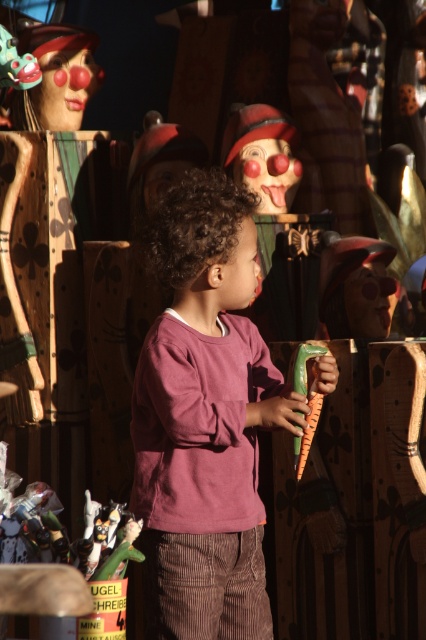
Question: Where is purple cotton shirt at center located in relation to matte plastic clown head at upper left in the image?

Choices:
 (A) left
 (B) right

Answer: (B)

Question: Does purple cotton shirt at center come in front of matte plastic clown head at upper left?

Choices:
 (A) yes
 (B) no

Answer: (A)

Question: Which point is farther to the camera?

Choices:
 (A) matte plastic clown head at upper left
 (B) purple cotton shirt at center

Answer: (A)

Question: Can you confirm if purple cotton shirt at center is wider than matte plastic clown head at upper left?

Choices:
 (A) yes
 (B) no

Answer: (A)